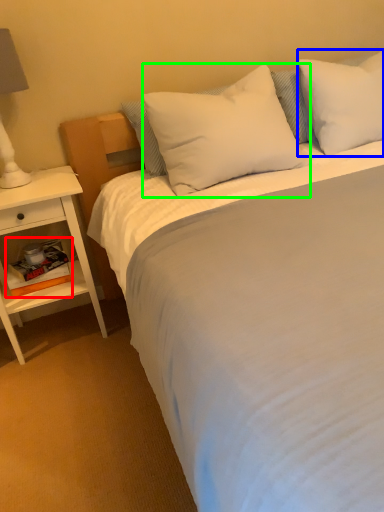
Question: Which object is positioned farthest from book (highlighted by a red box)? Select from pillow (highlighted by a blue box) and pillow (highlighted by a green box).

Choices:
 (A) pillow
 (B) pillow

Answer: (A)